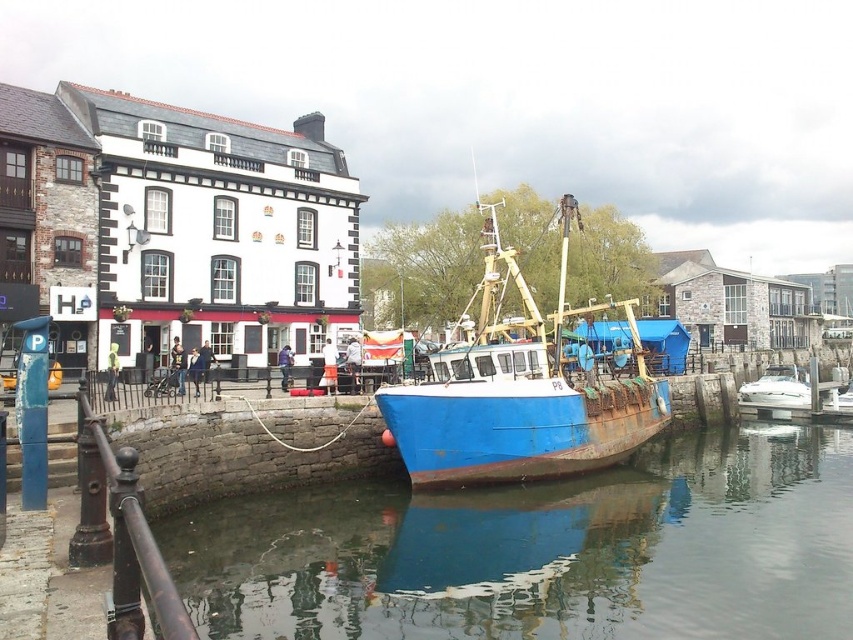
Question: Is rusty blue boat at center positioned at the back of white glossy boat at right?

Choices:
 (A) no
 (B) yes

Answer: (A)

Question: Which point is farther to the camera?

Choices:
 (A) (247, 508)
 (B) (376, 390)
 (C) (798, 392)

Answer: (C)

Question: Considering the real-world distances, which object is closest to the rusty blue boat at center?

Choices:
 (A) blue metallic water at lower center
 (B) white glossy boat at right

Answer: (A)

Question: Considering the relative positions of rusty blue boat at center and white glossy boat at right in the image provided, where is rusty blue boat at center located with respect to white glossy boat at right?

Choices:
 (A) below
 (B) above

Answer: (B)

Question: Which point is farther to the camera?

Choices:
 (A) rusty blue boat at center
 (B) blue metallic water at lower center

Answer: (A)

Question: Does blue metallic water at lower center appear on the right side of white glossy boat at right?

Choices:
 (A) yes
 (B) no

Answer: (B)